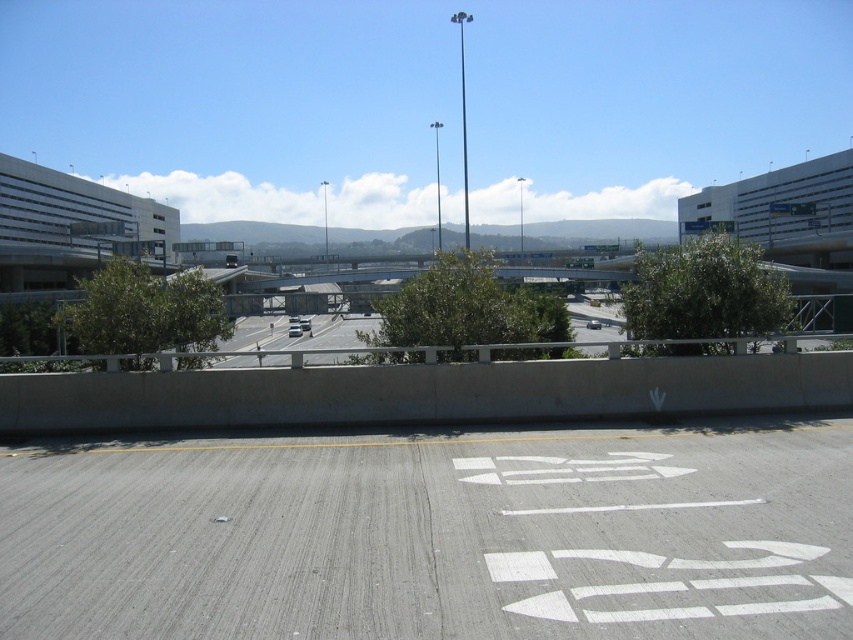
You are standing at the concrete barrier with a yellow line painted along its top edge in the foreground of the highway interchange. You want to walk to the gray asphalt road at center located at point (434, 534). Which direction should you walk relative to the concrete barrier?

You should walk towards the gray asphalt road at center located at point (434, 534), which is directly across from the concrete barrier with a yellow line painted along its top edge. Since the barrier separates the roadway from the foreground, you would need to walk towards the direction where the road surface with white directional markings and vehicles extends beyond the barrier.

You are driving a delivery truck and need to determine the correct path. According to the image, where is the gray asphalt road at center in relation to the gray asphalt highway at center?

The gray asphalt road at center is located below the gray asphalt highway at center, so you should look for the lower level road beneath the highway to continue your route.

You are a driver approaching the interchange and see the gray asphalt road at center and the gray asphalt highway at center. Which one is positioned to the right side from your perspective?

The gray asphalt road at center is positioned to the right of the gray asphalt highway at center.